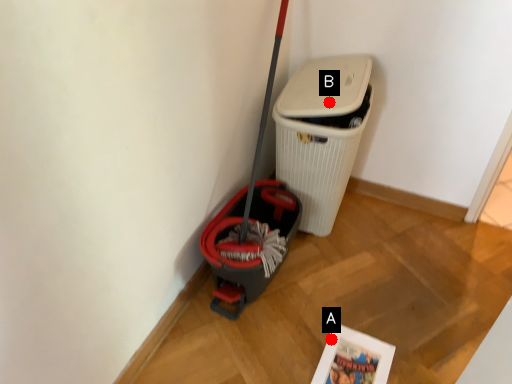
Question: Two points are circled on the image, labeled by A and B beside each circle. Which point appears closest to the camera in this image?

Choices:
 (A) A is closer
 (B) B is closer

Answer: (A)